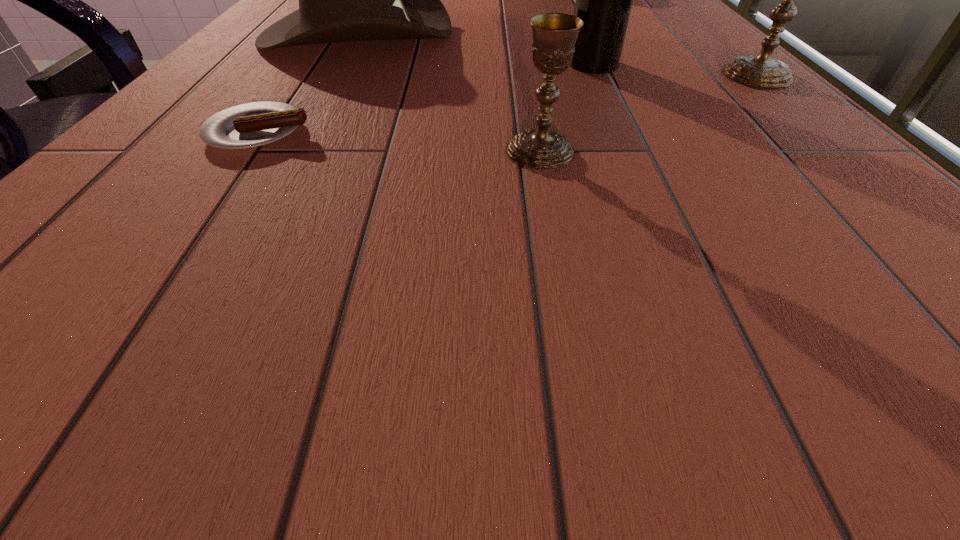
Identify the location of the left chalice. (554, 35).

Find the location of `the shorter chalice`. the shorter chalice is located at coordinates (554, 35).

The width and height of the screenshot is (960, 540). I want to click on the right chalice, so click(763, 70).

At what (x,y) coordinates should I click in order to perform the action: click on the farther chalice. Please return your answer as a coordinate pair (x, y). Looking at the image, I should click on (763, 70).

I want to click on cowboy hat, so click(340, 0).

Where is `the fourth object from left to right`? This screenshot has width=960, height=540. the fourth object from left to right is located at coordinates (604, 0).

Where is `wine bottle`? Image resolution: width=960 pixels, height=540 pixels. wine bottle is located at coordinates (604, 0).

Image resolution: width=960 pixels, height=540 pixels. In order to click on sausage in this screenshot , I will do `click(249, 125)`.

Where is `free space located on the right of the shorter chalice`? This screenshot has height=540, width=960. free space located on the right of the shorter chalice is located at coordinates (756, 151).

Locate an element on the screen. The image size is (960, 540). free space located 0.060m on the back of the fourth shortest object is located at coordinates (730, 50).